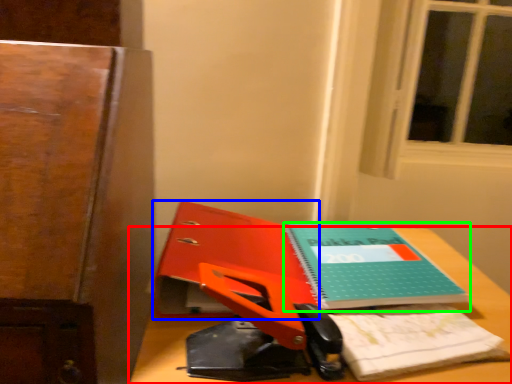
Question: Which is farther away from desk (highlighted by a red box)? paperback book (highlighted by a blue box) or book (highlighted by a green box)?

Choices:
 (A) paperback book
 (B) book

Answer: (A)